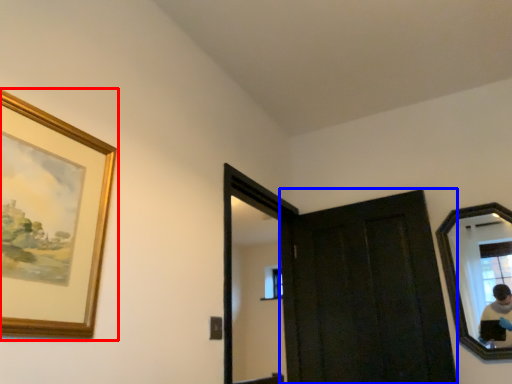
Question: Among these objects, which one is farthest to the camera, picture frame (highlighted by a red box) or door (highlighted by a blue box)?

Choices:
 (A) picture frame
 (B) door

Answer: (B)